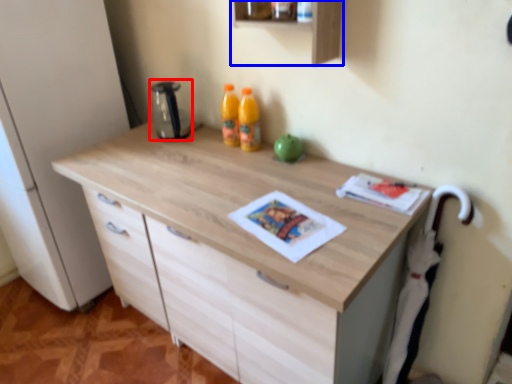
Question: Which object is further to the camera taking this photo, appliance (highlighted by a red box) or shelf (highlighted by a blue box)?

Choices:
 (A) appliance
 (B) shelf

Answer: (A)